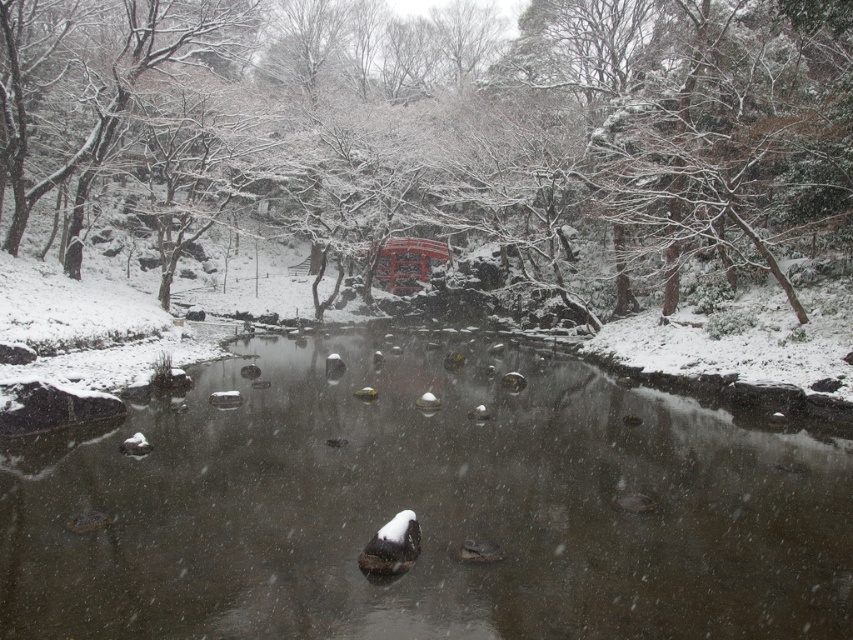
Question: Can you confirm if smooth stone river at center is smaller than snow-covered tree at center?

Choices:
 (A) no
 (B) yes

Answer: (B)

Question: Which of the following is the closest to the observer?

Choices:
 (A) snow-covered tree at center
 (B) smooth stone river at center

Answer: (B)

Question: Does smooth stone river at center have a larger size compared to snow-covered tree at center?

Choices:
 (A) yes
 (B) no

Answer: (B)

Question: Which of the following is the closest to the observer?

Choices:
 (A) (189, 504)
 (B) (751, 216)

Answer: (A)

Question: Is smooth stone river at center above snow-covered tree at center?

Choices:
 (A) yes
 (B) no

Answer: (B)